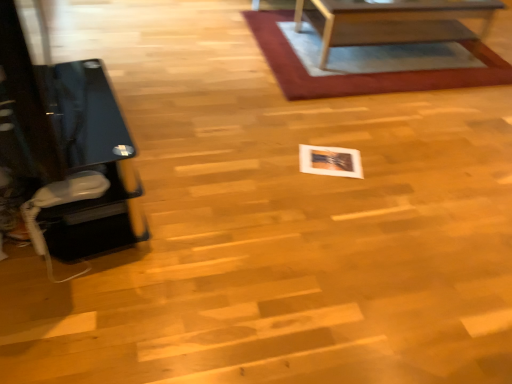
Where is `blank area beneath white glossy photo frame at center (from a real-world perspective)`? The height and width of the screenshot is (384, 512). blank area beneath white glossy photo frame at center (from a real-world perspective) is located at coordinates coord(325,161).